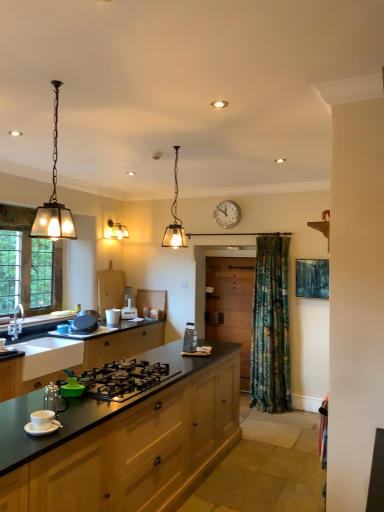
Locate an element on the screen. free space above matte glass pendant light at center (from a real-world perspective) is located at coordinates (175, 148).